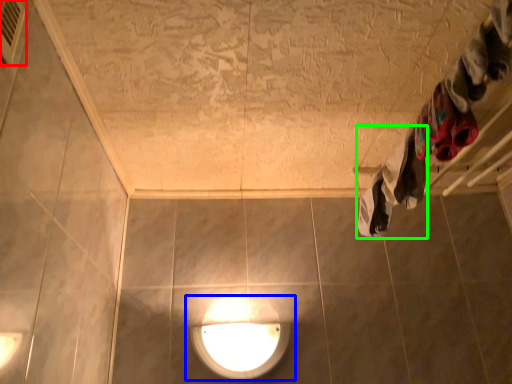
Question: Which is nearer to the air conditioner (highlighted by a red box)? lamp (highlighted by a blue box) or clothing (highlighted by a green box).

Choices:
 (A) lamp
 (B) clothing

Answer: (B)